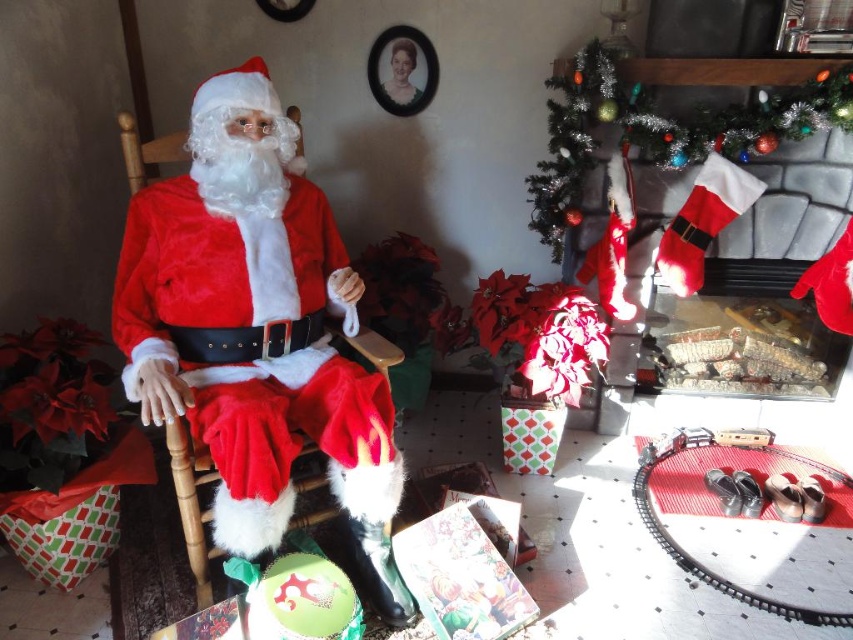
Is the position of velvet red santa at left more distant than that of red velvet stocking at upper right?

No, it is in front of red velvet stocking at upper right.

Is the position of velvet red santa at left less distant than that of red velvet stocking at upper right?

Yes.

In the scene shown: Who is more forward, (209, 396) or (552, 180)?

Point (209, 396)

At what (x,y) coordinates should I click in order to perform the action: click on velvet red santa at left. Please return your answer as a coordinate pair (x, y). Looking at the image, I should click on (256, 330).